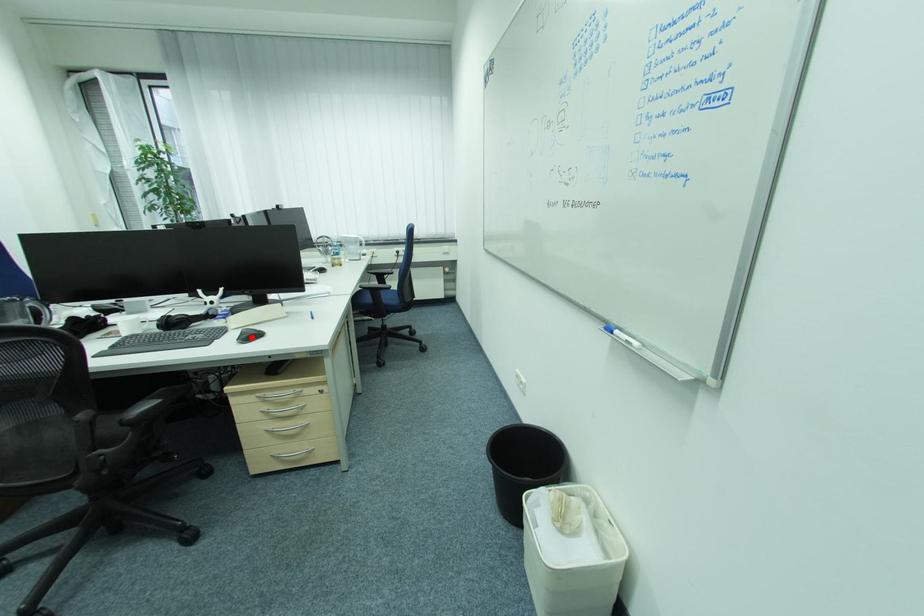
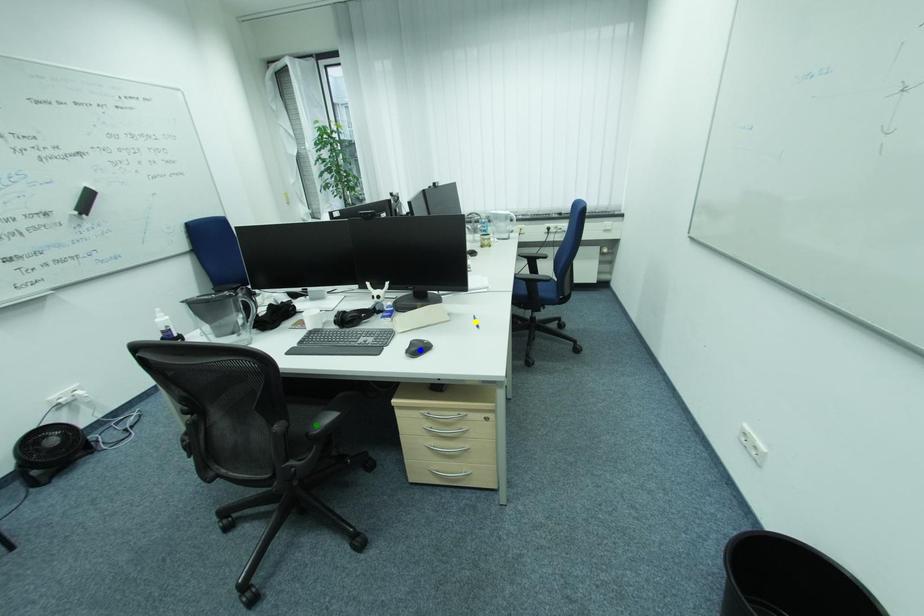
Question: I am providing you with two images of the same scene from different viewpoints. A red point is marked on the first image. You are given multiple points on the second image. In image 2, which mark is for the same physical point as the one in image 1?

Choices:
 (A) blue point
 (B) yellow point
 (C) green point

Answer: (A)